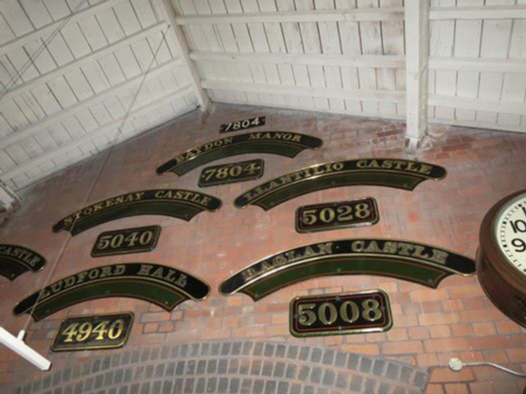
At what (x,y) coordinates should I click in order to perform the action: click on wooden beam. Please return your answer as a coordinate pair (x, y). Looking at the image, I should click on (416, 26).